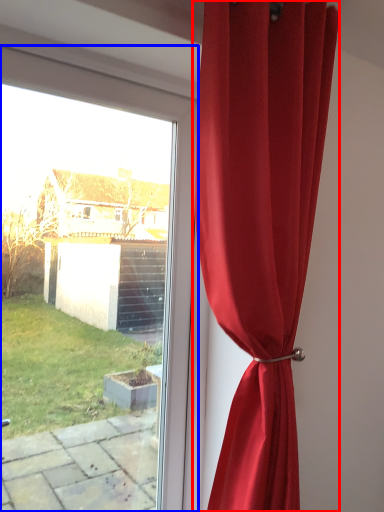
Question: Which point is further to the camera, curtain (highlighted by a red box) or window (highlighted by a blue box)?

Choices:
 (A) curtain
 (B) window

Answer: (B)